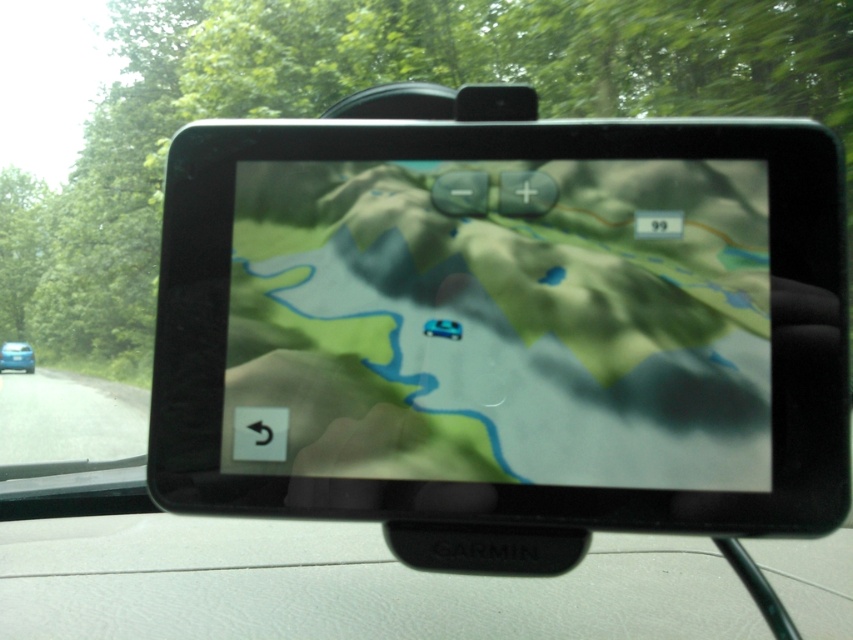
You are driving a car and looking at the GPS device. You see the green matte map at center and the blue glossy car at center. Which object is positioned higher on the screen?

The green matte map at center is above the blue glossy car at center, so the green matte map at center is positioned higher on the screen.

Based on the photo, you are looking at a GPS device mounted on a car dashboard. The GPS shows a map with a blue vehicle icon at the center. There is also a point labeled at coordinates (x=502, y=323). Where on the map does this point indicate?

The point labeled at coordinates (x=502, y=323) corresponds to the green matte map at center.

You are driving a car and want to check the GPS device mounted on your dashboard. The GPS shows a green matte map at center and a blue glossy car at center. If you want to see more details of the road ahead, which button should you press?

You should press the plus button to zoom in on the green matte map at center, allowing you to see more details of the road ahead.